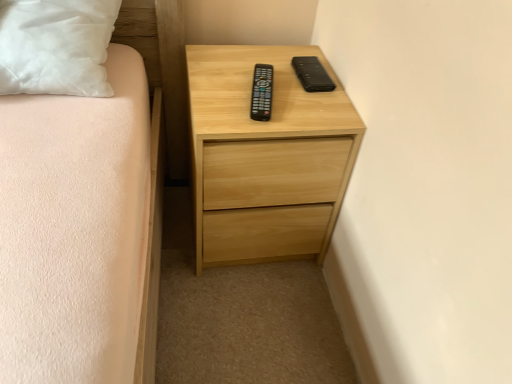
In order to click on spots to the right of black plastic remote at center in this screenshot , I will do `click(311, 110)`.